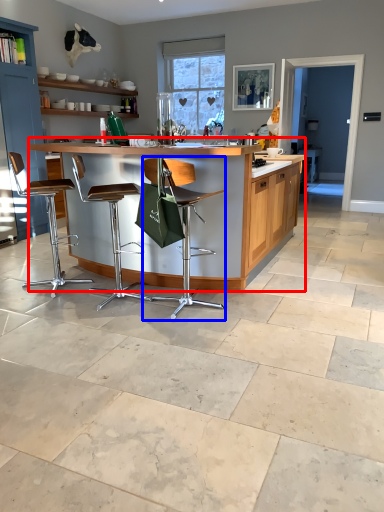
Question: Among these objects, which one is nearest to the camera, table (highlighted by a red box) or chair (highlighted by a blue box)?

Choices:
 (A) table
 (B) chair

Answer: (B)